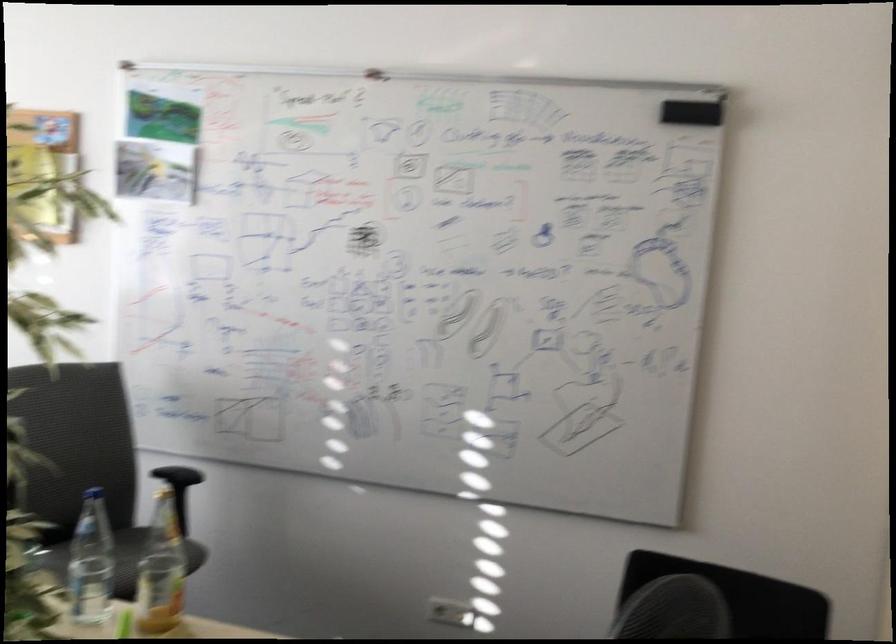
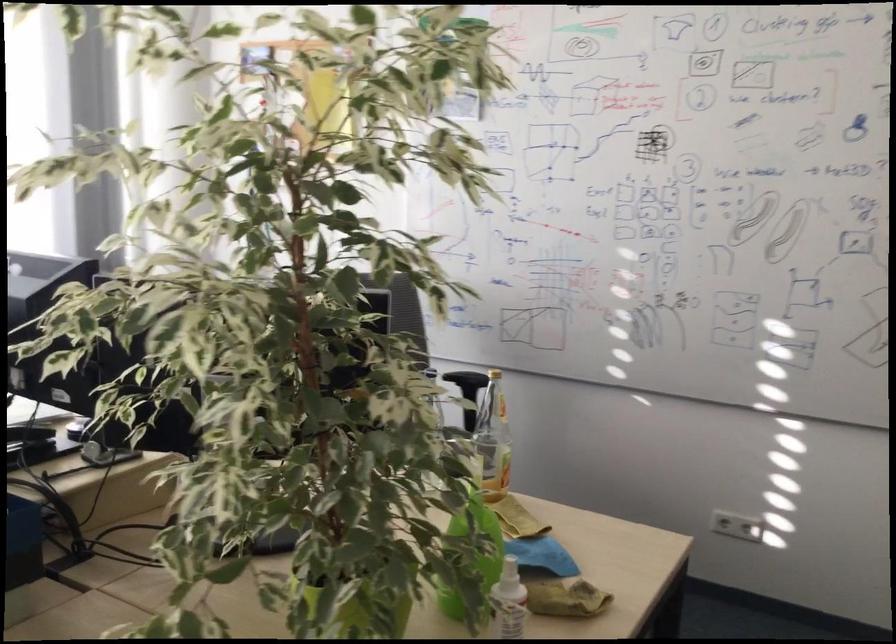
Question: The first image is from the beginning of the video and the second image is from the end. How did the camera likely rotate when shooting the video?

Choices:
 (A) Left
 (B) Right
 (C) Up
 (D) Down

Answer: (A)